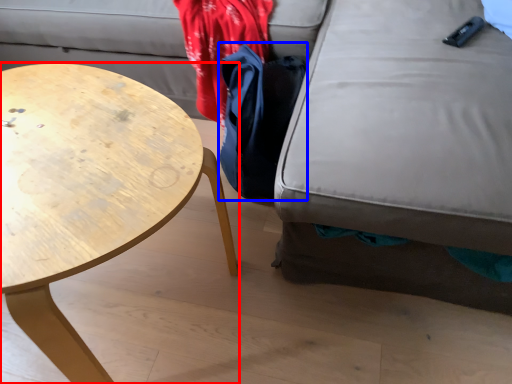
Question: Which object appears closest to the camera in this image, coffee table (highlighted by a red box) or cloak (highlighted by a blue box)?

Choices:
 (A) coffee table
 (B) cloak

Answer: (A)